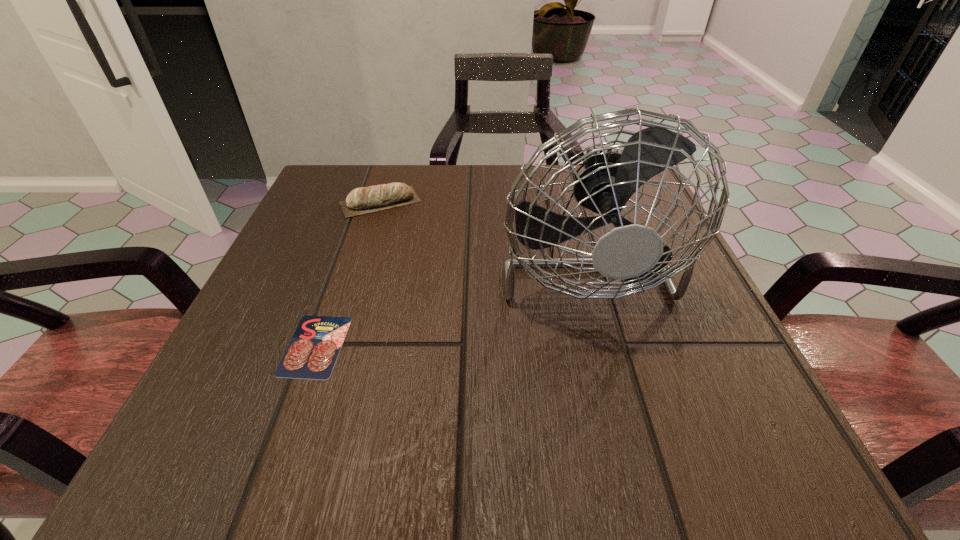
Where is `fan`? This screenshot has width=960, height=540. fan is located at coordinates (630, 252).

The image size is (960, 540). What are the coordinates of `the tallest object` in the screenshot? It's located at (630, 252).

Where is `the second tallest object`? This screenshot has height=540, width=960. the second tallest object is located at coordinates (363, 200).

The height and width of the screenshot is (540, 960). What are the coordinates of `the shortest object` in the screenshot? It's located at (312, 352).

Where is `vacant space situated on the front-facing side of the tallest object`? The width and height of the screenshot is (960, 540). vacant space situated on the front-facing side of the tallest object is located at coordinates (632, 454).

Identify the location of free space located on the front of the pita bread. Image resolution: width=960 pixels, height=540 pixels. pos(336,346).

Where is `vacant space located 0.240m on the right of the shortest object`? The image size is (960, 540). vacant space located 0.240m on the right of the shortest object is located at coordinates (506, 346).

Where is `fan that is at the far edge`? The height and width of the screenshot is (540, 960). fan that is at the far edge is located at coordinates (630, 252).

Image resolution: width=960 pixels, height=540 pixels. Identify the location of pita bread that is at the far edge. (363, 200).

Image resolution: width=960 pixels, height=540 pixels. In order to click on pita bread that is at the left edge in this screenshot , I will do `click(363, 200)`.